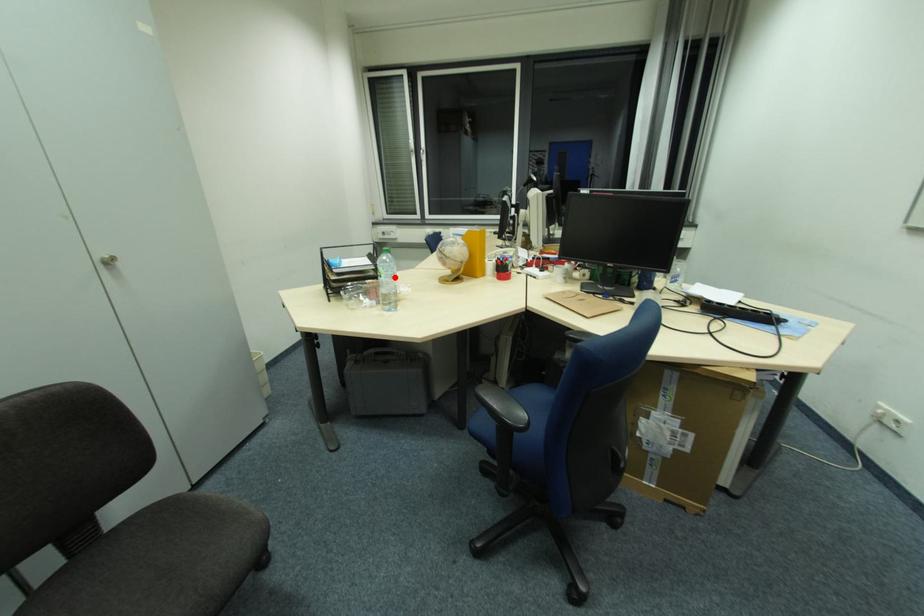
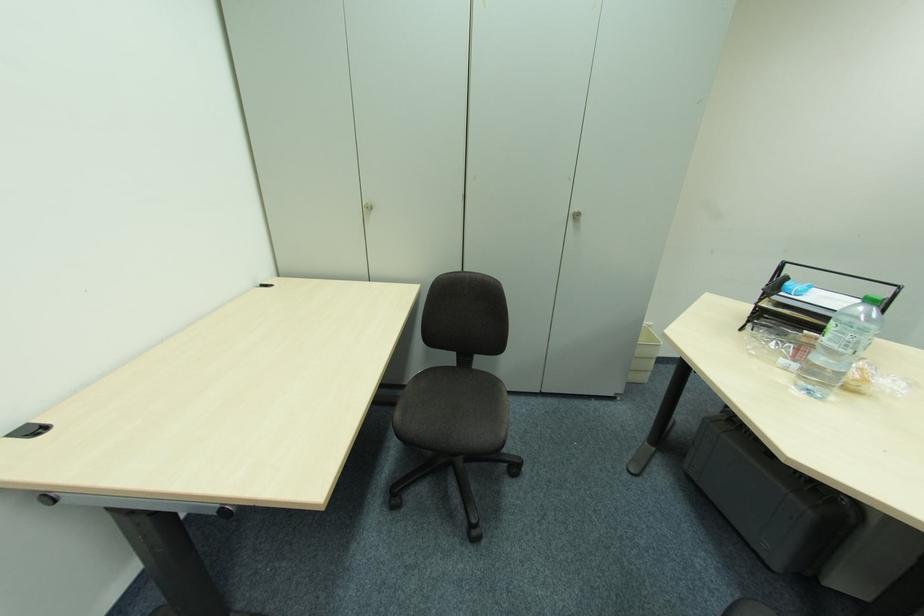
Question: A red point is marked in image1. In image2, is the corresponding 3D point closer to the camera or farther? Reply with the corresponding letter.

Choices:
 (A) The corresponding 3D point is closer.
 (B) The corresponding 3D point is farther.

Answer: (B)